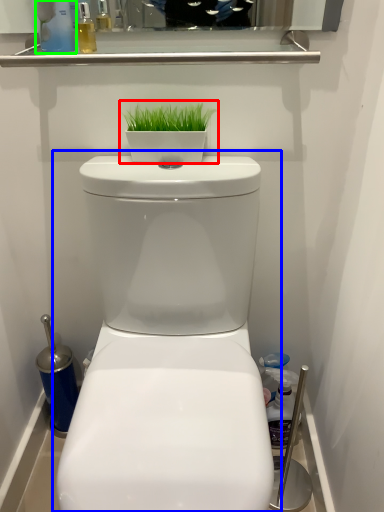
Question: Which object is the farthest from houseplant (highlighted by a red box)? Choose among these: toilet (highlighted by a blue box) or cleaning product (highlighted by a green box).

Choices:
 (A) toilet
 (B) cleaning product

Answer: (A)